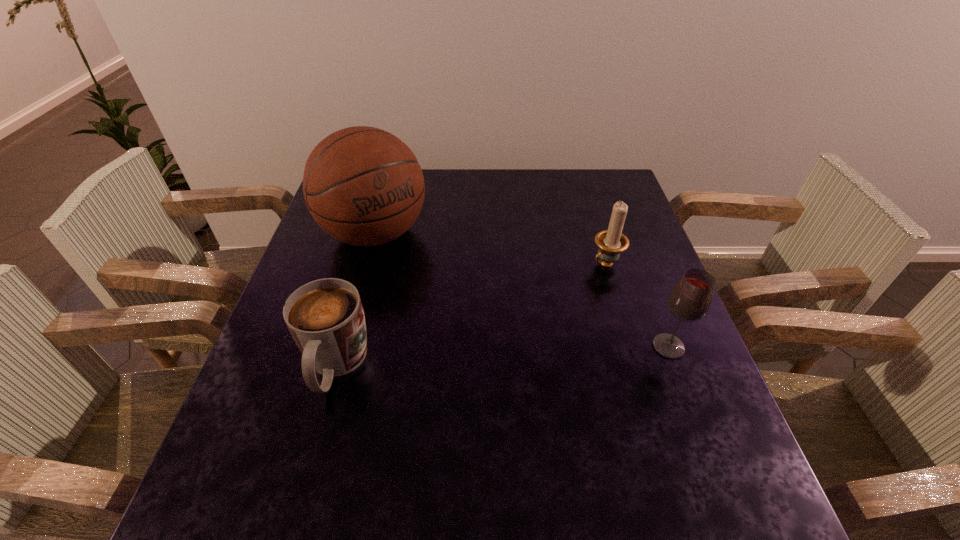
The width and height of the screenshot is (960, 540). I want to click on mug, so click(325, 317).

Locate an element on the screen. Image resolution: width=960 pixels, height=540 pixels. the rightmost object is located at coordinates (690, 299).

Locate an element on the screen. the third object from left to right is located at coordinates (611, 242).

The height and width of the screenshot is (540, 960). I want to click on the tallest object, so click(364, 186).

Identify the location of free space located 0.050m on the side of the mug with the handle. Image resolution: width=960 pixels, height=540 pixels. [x=316, y=435].

Locate an element on the screen. The width and height of the screenshot is (960, 540). vacant space located on the left of the glass drink container is located at coordinates (619, 347).

The height and width of the screenshot is (540, 960). In order to click on free spot located 0.070m on the handle side of the third object from left to right in this screenshot , I will do `click(580, 286)`.

The image size is (960, 540). I want to click on free region located 0.330m on the handle side of the third object from left to right, so click(509, 345).

Identify the location of vacant space situated 0.160m on the handle side of the third object from left to right. This screenshot has height=540, width=960. (558, 305).

You are a GUI agent. You are given a task and a screenshot of the screen. Output one action in this format:
    pyautogui.click(x=<x>, y=<y>)
    Task: Click on the free space located 0.110m on the side with brand label of the tallest object
    
    Given the screenshot: What is the action you would take?
    pyautogui.click(x=420, y=288)